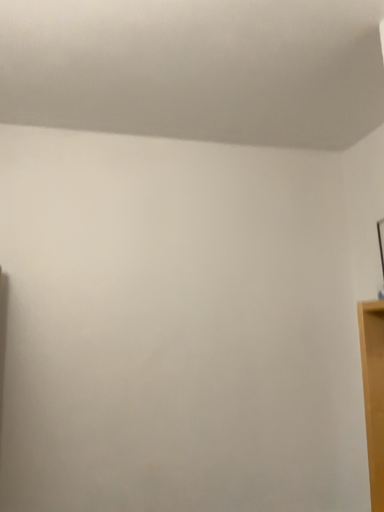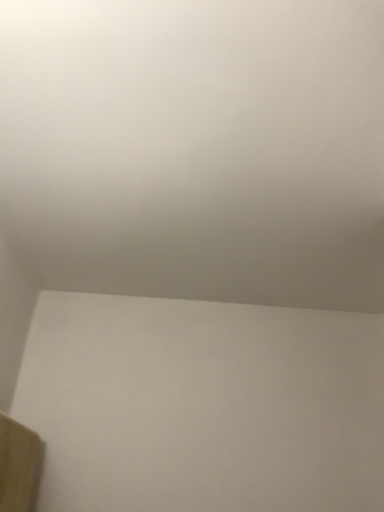
Question: How did the camera likely rotate when shooting the video?

Choices:
 (A) rotated downward
 (B) rotated upward

Answer: (B)